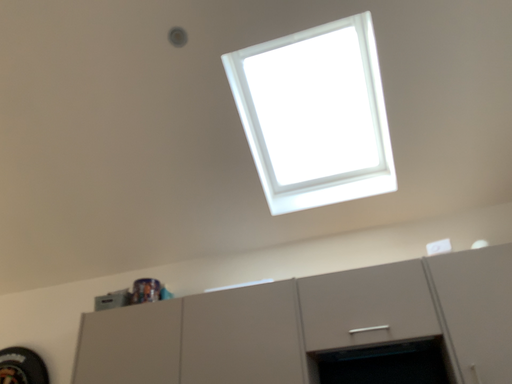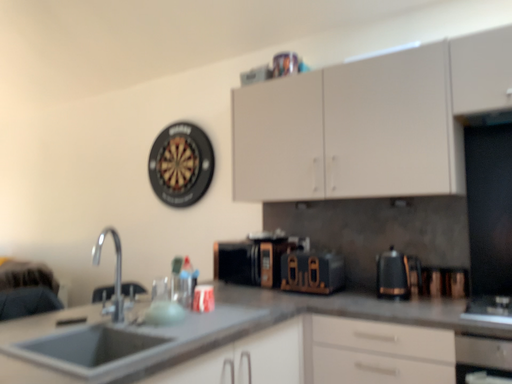
Question: Which way did the camera rotate in the video?

Choices:
 (A) rotated right
 (B) rotated left

Answer: (B)